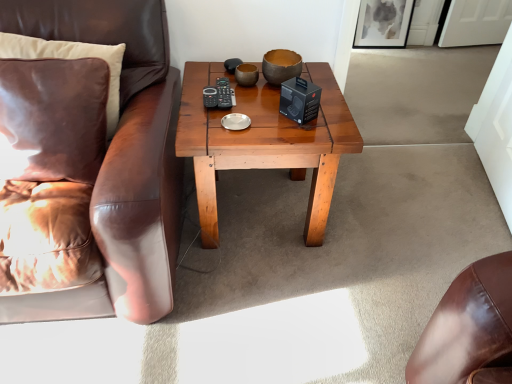
Where is `vacant point above matte brown bowl at center (from a real-world perspective)`? vacant point above matte brown bowl at center (from a real-world perspective) is located at coordinates (281, 56).